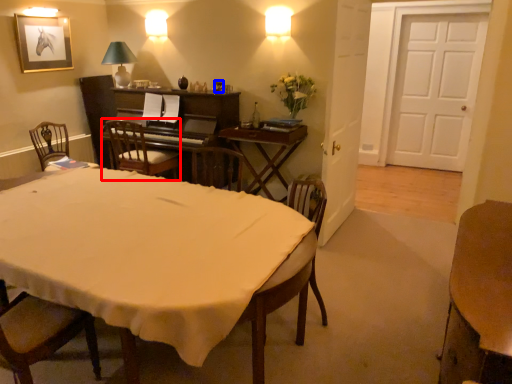
Question: Which point is further to the camera, chair (highlighted by a red box) or wine glass (highlighted by a blue box)?

Choices:
 (A) chair
 (B) wine glass

Answer: (B)